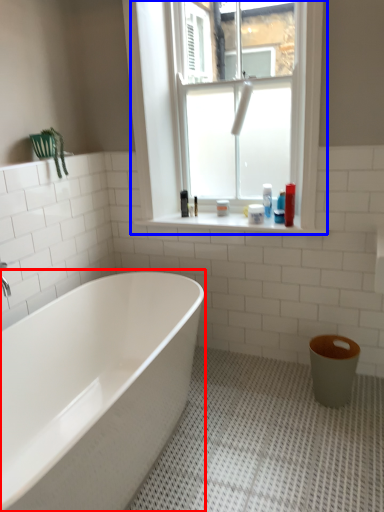
Question: Which object appears closest to the camera in this image, bathtub (highlighted by a red box) or window (highlighted by a blue box)?

Choices:
 (A) bathtub
 (B) window

Answer: (A)